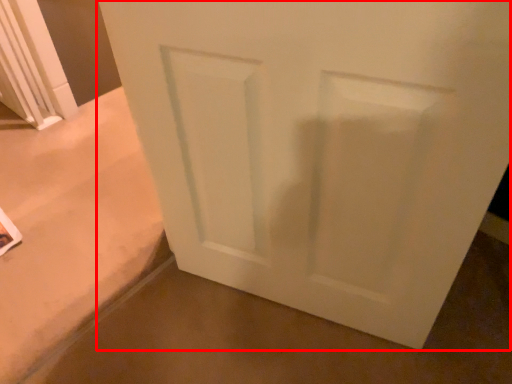
Question: From the image, what is the correct spatial relationship of door (annotated by the red box) in relation to concrete?

Choices:
 (A) right
 (B) left

Answer: (B)